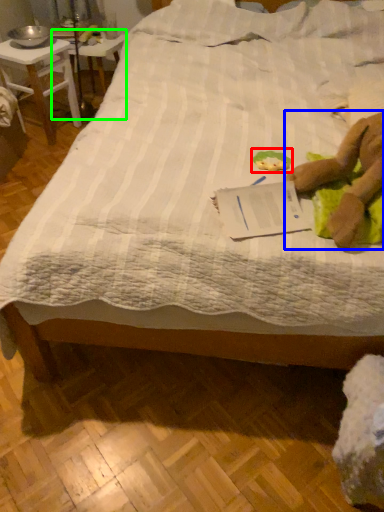
Question: Which object is positioned farthest from toy (highlighted by a red box)? Select from person (highlighted by a blue box) and table (highlighted by a green box).

Choices:
 (A) person
 (B) table

Answer: (B)